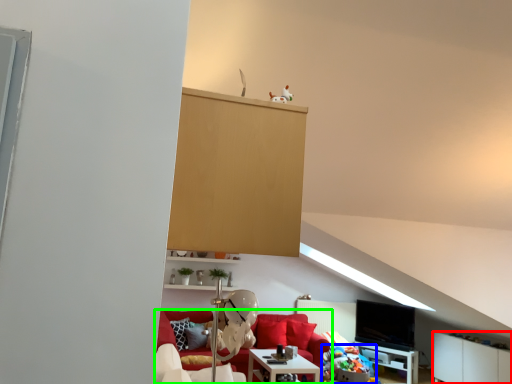
Question: Considering the real-world distances, which object is farthest from cabinetry (highlighted by a red box)? stuff (highlighted by a blue box) or studio couch (highlighted by a green box)?

Choices:
 (A) stuff
 (B) studio couch

Answer: (B)